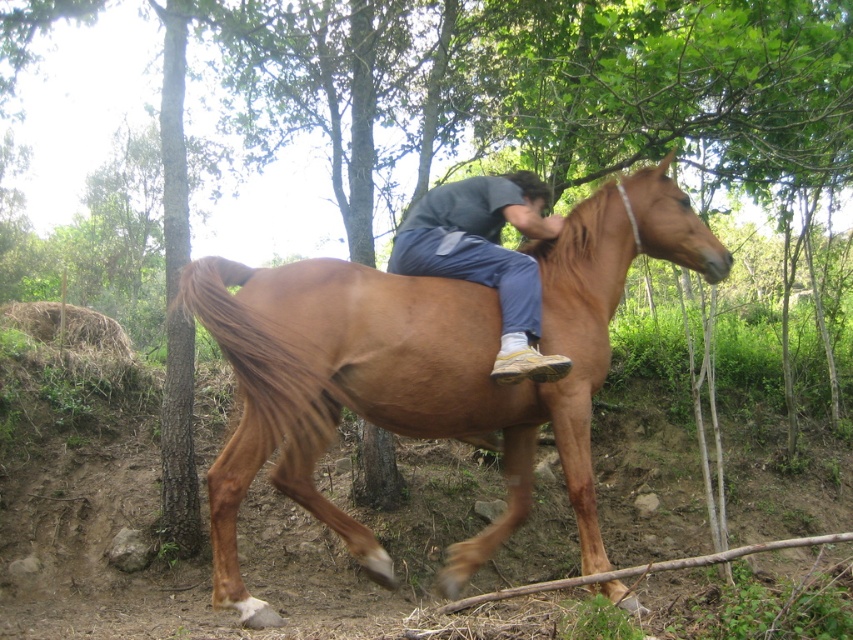
Question: Where is brown glossy horse at center located in relation to matte blue jeans at center in the image?

Choices:
 (A) left
 (B) right

Answer: (B)

Question: Which of the following is the farthest from the observer?

Choices:
 (A) brown glossy horse at center
 (B) matte blue jeans at center

Answer: (B)

Question: Which point is farther to the camera?

Choices:
 (A) (308, 337)
 (B) (495, 257)

Answer: (B)

Question: Is brown glossy horse at center smaller than matte blue jeans at center?

Choices:
 (A) yes
 (B) no

Answer: (B)

Question: Which point is farther from the camera taking this photo?

Choices:
 (A) (451, 200)
 (B) (222, 344)

Answer: (A)

Question: Is brown glossy horse at center behind matte blue jeans at center?

Choices:
 (A) no
 (B) yes

Answer: (A)